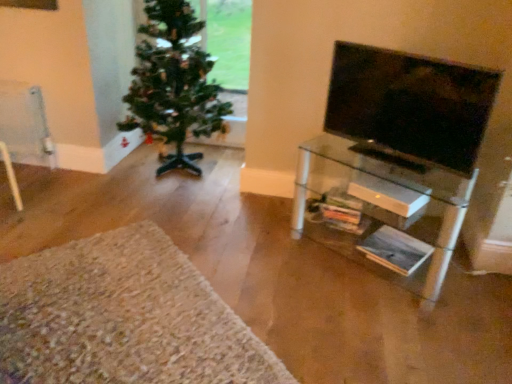
The width and height of the screenshot is (512, 384). What do you see at coordinates (411, 104) in the screenshot?
I see `black glossy tv at right` at bounding box center [411, 104].

Image resolution: width=512 pixels, height=384 pixels. Identify the location of green matte christmas tree at left. (173, 84).

Consider the image. Does white shaggy rug at lower left touch clear glass shelf at right?

No, white shaggy rug at lower left is not beside clear glass shelf at right.

Considering the positions of point (83, 305) and point (401, 202), is point (83, 305) closer or farther from the camera than point (401, 202)?

Point (83, 305) appears to be closer to the viewer than point (401, 202).

Is white shaggy rug at lower left shorter than clear glass shelf at right?

Correct, white shaggy rug at lower left is not as tall as clear glass shelf at right.

I want to click on plain in front of the clear glass shelf at right, so click(x=123, y=317).

Looking at this image, from a real-world perspective, between black glossy tv at right and clear glass shelf at right, who is vertically higher?

In real-world perspective, black glossy tv at right is above.

Considering the positions of objects black glossy tv at right and clear glass shelf at right in the image provided, who is more to the right, black glossy tv at right or clear glass shelf at right?

Positioned to the right is clear glass shelf at right.

Considering the positions of points (437, 88) and (406, 262), is point (437, 88) closer to camera compared to point (406, 262)?

Yes, point (437, 88) is in front of point (406, 262).

Which object is positioned more to the left, clear glass shelf at right or green matte christmas tree at left?

Positioned to the left is green matte christmas tree at left.

Considering the relative sizes of clear glass shelf at right and green matte christmas tree at left in the image provided, is clear glass shelf at right bigger than green matte christmas tree at left?

Incorrect, clear glass shelf at right is not larger than green matte christmas tree at left.

Consider the image. What's the angular difference between clear glass shelf at right and green matte christmas tree at left's facing directions?

The angular difference between clear glass shelf at right and green matte christmas tree at left is 33.5 degrees.

Is clear glass shelf at right oriented towards green matte christmas tree at left?

No, clear glass shelf at right is not turned towards green matte christmas tree at left.

Is white shaggy rug at lower left to the left or to the right of black glossy tv at right in the image?

white shaggy rug at lower left is positioned on black glossy tv at right's left side.

Is white shaggy rug at lower left looking in the opposite direction of black glossy tv at right?

No, black glossy tv at right is not at the back of white shaggy rug at lower left.

Is black glossy tv at right surrounded by white shaggy rug at lower left?

No, white shaggy rug at lower left does not contain black glossy tv at right.

Does white shaggy rug at lower left have a lesser width compared to black glossy tv at right?

In fact, white shaggy rug at lower left might be wider than black glossy tv at right.

How different are the orientations of green matte christmas tree at left and white shaggy rug at lower left in degrees?

46.6 degrees separate the facing orientations of green matte christmas tree at left and white shaggy rug at lower left.

Is point (177, 32) more distant than point (86, 306)?

Yes, it is.

Are green matte christmas tree at left and white shaggy rug at lower left located far from each other?

green matte christmas tree at left is far away from white shaggy rug at lower left.

Considering the sizes of objects green matte christmas tree at left and white shaggy rug at lower left in the image provided, who is smaller, green matte christmas tree at left or white shaggy rug at lower left?

white shaggy rug at lower left is smaller.

Consider the image. Can you tell me how much green matte christmas tree at left and black glossy tv at right differ in facing direction?

The facing directions of green matte christmas tree at left and black glossy tv at right are 33.3 degrees apart.

Which of these two, green matte christmas tree at left or black glossy tv at right, is thinner?

Thinner between the two is black glossy tv at right.

From a real-world perspective, is green matte christmas tree at left physically located above or below black glossy tv at right?

green matte christmas tree at left is below black glossy tv at right.

Which object is more forward, green matte christmas tree at left or black glossy tv at right?

black glossy tv at right is in front.

Between black glossy tv at right and white shaggy rug at lower left, which one has larger size?

white shaggy rug at lower left.

From the image's perspective, which one is positioned higher, black glossy tv at right or white shaggy rug at lower left?

black glossy tv at right, from the image's perspective.

Considering the sizes of objects black glossy tv at right and white shaggy rug at lower left in the image provided, who is shorter, black glossy tv at right or white shaggy rug at lower left?

white shaggy rug at lower left is shorter.

From the picture: Is black glossy tv at right facing towards white shaggy rug at lower left?

No, black glossy tv at right is not oriented towards white shaggy rug at lower left.

The image size is (512, 384). What are the coordinates of `plain located on the left of clear glass shelf at right` in the screenshot? It's located at (123, 317).

This screenshot has width=512, height=384. In the image, there is a black glossy tv at right. What are the coordinates of `shelf below it (from a real-world perspective)` in the screenshot? It's located at (391, 203).

Which object lies nearer to the anchor point white shaggy rug at lower left, clear glass shelf at right or black glossy tv at right?

clear glass shelf at right is closer to white shaggy rug at lower left.

From the image, which object appears to be nearer to clear glass shelf at right, black glossy tv at right or white shaggy rug at lower left?

Based on the image, black glossy tv at right appears to be nearer to clear glass shelf at right.

Which object lies nearer to the anchor point green matte christmas tree at left, black glossy tv at right or white shaggy rug at lower left?

Based on the image, black glossy tv at right appears to be nearer to green matte christmas tree at left.

When comparing their distances from clear glass shelf at right, does white shaggy rug at lower left or green matte christmas tree at left seem closer?

Based on the image, green matte christmas tree at left appears to be nearer to clear glass shelf at right.

Considering their positions, is green matte christmas tree at left positioned further to black glossy tv at right than white shaggy rug at lower left?

Based on the image, white shaggy rug at lower left appears to be further to black glossy tv at right.

Based on their spatial positions, is black glossy tv at right or green matte christmas tree at left closer to white shaggy rug at lower left?

Answer: black glossy tv at right is closer to white shaggy rug at lower left.

Estimate the real-world distances between objects in this image. Which object is closer to white shaggy rug at lower left, green matte christmas tree at left or black glossy tv at right?

black glossy tv at right is positioned closer to the anchor white shaggy rug at lower left.

In the scene shown: Which object lies nearer to the anchor point clear glass shelf at right, green matte christmas tree at left or black glossy tv at right?

Among the two, black glossy tv at right is located nearer to clear glass shelf at right.

Find the location of a particular element. The height and width of the screenshot is (384, 512). christmas tree between white shaggy rug at lower left and black glossy tv at right in the horizontal direction is located at coordinates (173, 84).

You are a GUI agent. You are given a task and a screenshot of the screen. Output one action in this format:
    pyautogui.click(x=<x>, y=<y>)
    Task: Click on the christmas tree between white shaggy rug at lower left and clear glass shelf at right
    This screenshot has height=384, width=512.
    Given the screenshot: What is the action you would take?
    pyautogui.click(x=173, y=84)

You are a GUI agent. You are given a task and a screenshot of the screen. Output one action in this format:
    pyautogui.click(x=<x>, y=<y>)
    Task: Click on the television between white shaggy rug at lower left and clear glass shelf at right
    The image size is (512, 384).
    Given the screenshot: What is the action you would take?
    pyautogui.click(x=411, y=104)

Find the location of a particular element. television between green matte christmas tree at left and clear glass shelf at right is located at coordinates (411, 104).